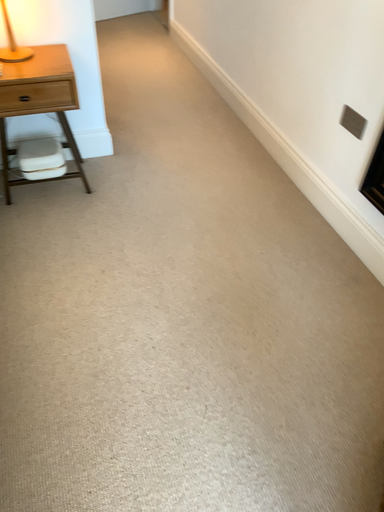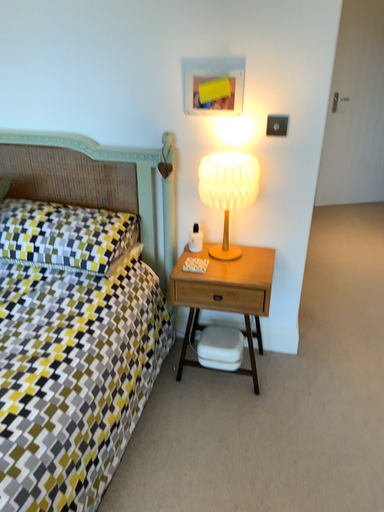
Question: How did the camera likely rotate when shooting the video?

Choices:
 (A) rotated left
 (B) rotated right

Answer: (A)